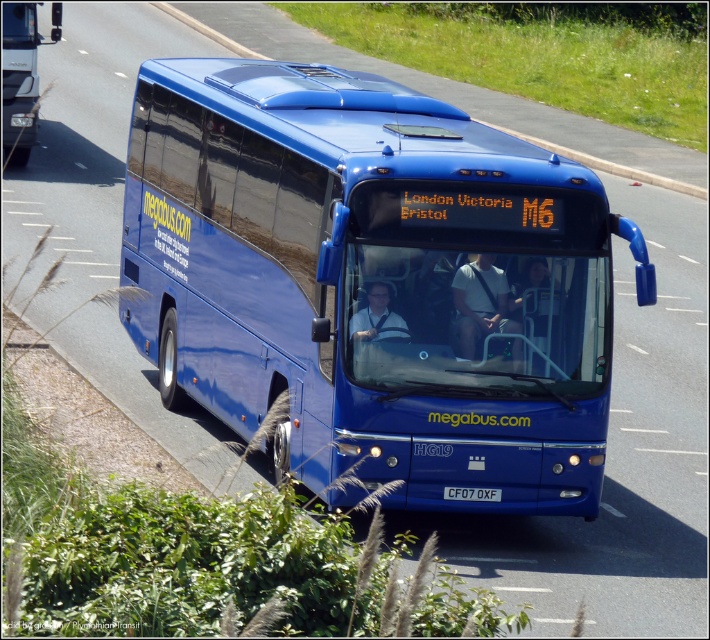
Looking at this image, you are standing on the sidewalk and see both the blue metallic bus at center and the matte blue bus at upper center. Which one is positioned to the right side of the other?

The blue metallic bus at center is positioned to the right of the matte blue bus at upper center.

You are a passenger on the matte blue bus at upper center and want to read the white plastic license plate at center. Is the license plate easy to read from your seat?

The matte blue bus at upper center is larger in size than the white plastic license plate at center, so the license plate may be too small to read clearly from your seat.

You are a pedestrian standing on the sidewalk near the road where the blue metallic bus at center and the matte blue bus at upper center are located. You want to cross the road to reach the other side. Considering the distance between the two buses, is there enough space for you to safely cross between them without getting too close?

The distance between the blue metallic bus at center and the matte blue bus at upper center is 15.59 meters. Since this distance is sufficient for a pedestrian to cross safely while maintaining a safe distance from both buses, you can cross between them.